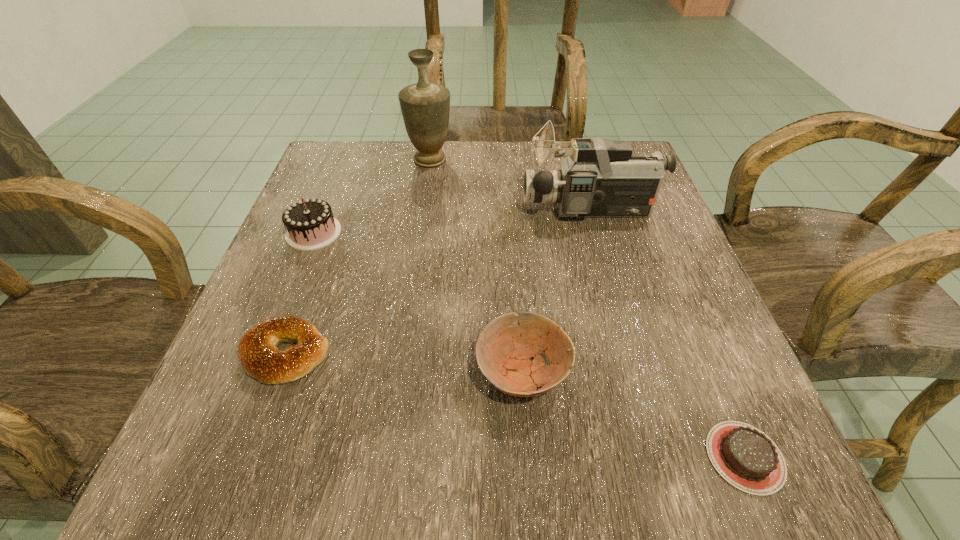
At what (x,y) coordinates should I click in order to perform the action: click on free space between the camcorder and the fourth shortest object. Please return your answer as a coordinate pair (x, y). This screenshot has width=960, height=540. Looking at the image, I should click on (452, 221).

You are a GUI agent. You are given a task and a screenshot of the screen. Output one action in this format:
    pyautogui.click(x=<x>, y=<y>)
    Task: Click on the empty location between the tallest object and the fifth shortest object
    This screenshot has width=960, height=540.
    Given the screenshot: What is the action you would take?
    pyautogui.click(x=511, y=185)

Select which object appears as the fourth closest to the bowl. Please provide its 2D coordinates. Your answer should be formatted as a tuple, i.e. [(x, y)], where the tuple contains the x and y coordinates of a point satisfying the conditions above.

[(310, 223)]

Identify which object is the second closest to the shorter chocolate cake. Please provide its 2D coordinates. Your answer should be formatted as a tuple, i.e. [(x, y)], where the tuple contains the x and y coordinates of a point satisfying the conditions above.

[(601, 178)]

You are a GUI agent. You are given a task and a screenshot of the screen. Output one action in this format:
    pyautogui.click(x=<x>, y=<y>)
    Task: Click on the free point that satisfies the following two spatial constraints: 1. on the front side of the bagel; 2. on the left side of the fourth shortest object
    The height and width of the screenshot is (540, 960).
    Given the screenshot: What is the action you would take?
    pyautogui.click(x=265, y=353)

Identify the location of free spot that satisfies the following two spatial constraints: 1. on the back side of the tallest object; 2. on the left side of the left chocolate cake. The height and width of the screenshot is (540, 960). (343, 160).

Identify the location of vacant space that satisfies the following two spatial constraints: 1. on the front-facing side of the nearest object; 2. on the left side of the camcorder. (660, 457).